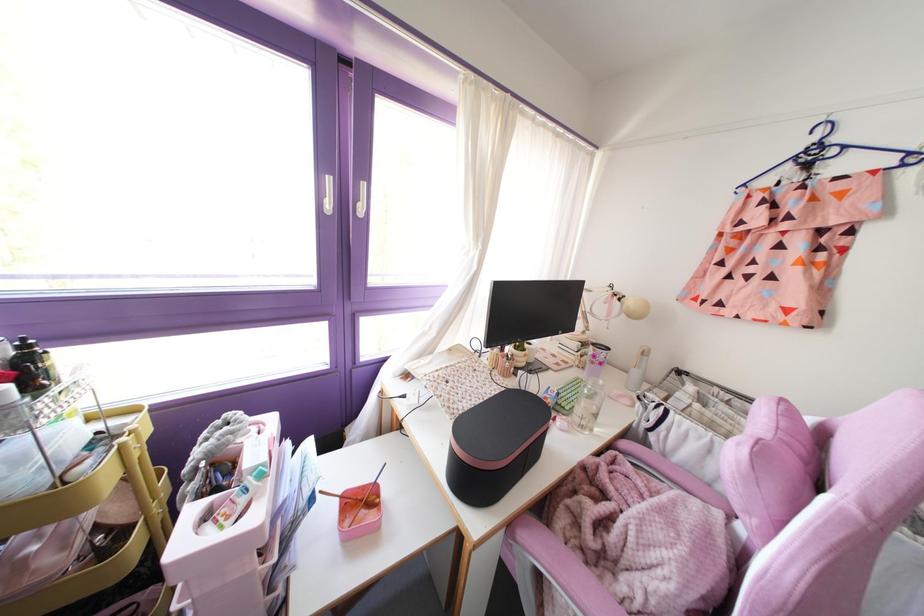
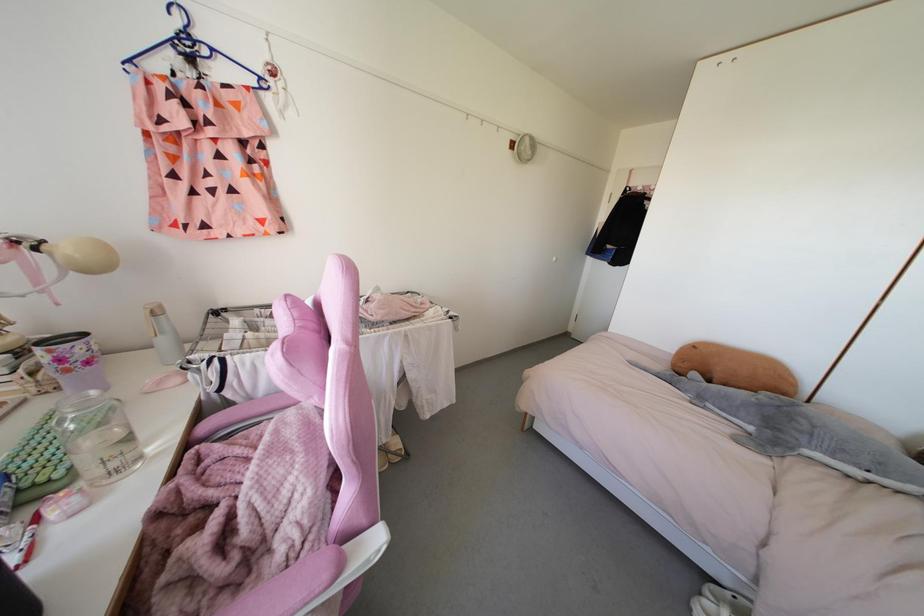
Find the pixel in the second image that matches [601,382] in the first image.

(92, 392)